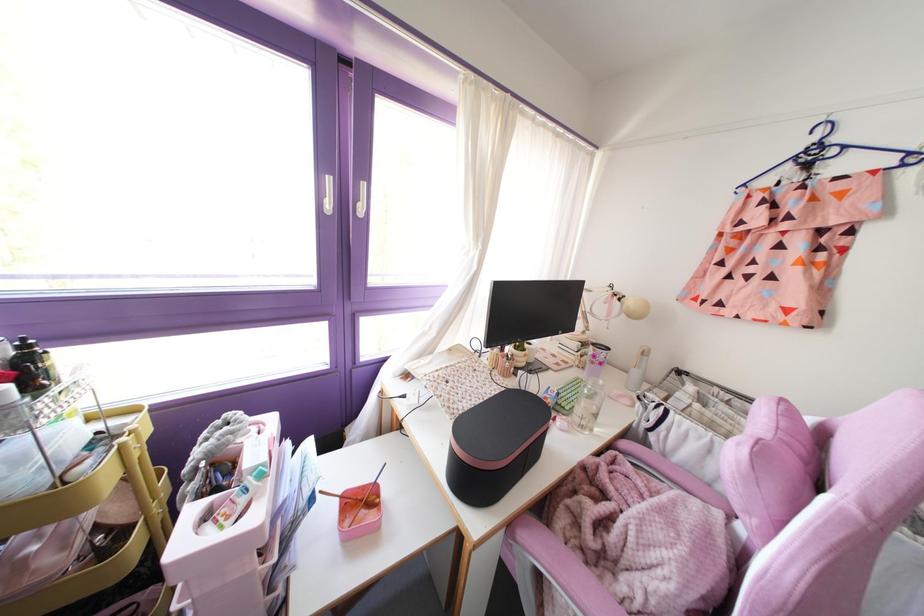
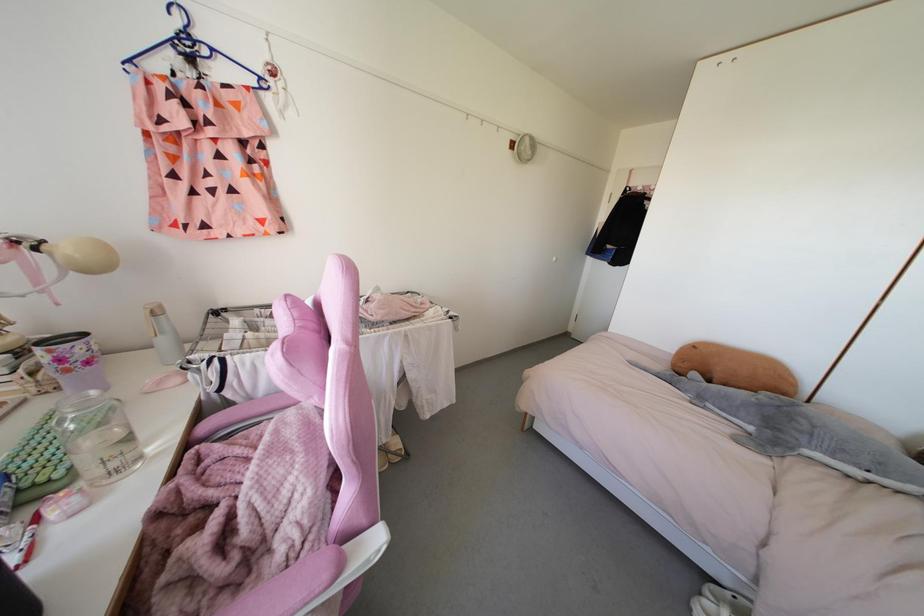
Find the pixel in the second image that matches [601,382] in the first image.

(92, 392)